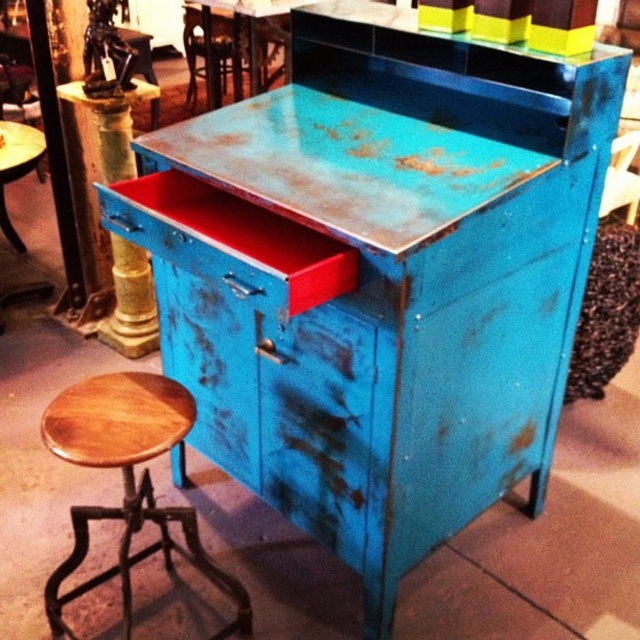
You are standing in front of the vintage blue cabinet with a red drawer. There are two points marked on the cabinet. One is at coordinate point (148, 454) and the other is at point (621, 204). Which point is closer to you?

Point (148, 454) is closer to the camera than point (621, 204).

You are organizing a small event and need to arrange seating. You have a wooden chair at center and a metallic blue chair at center. If you want to place both chairs so that the metallic blue chair is visible from the front entrance, where should you position them relative to each other?

To ensure the metallic blue chair at center is visible from the front entrance, position the wooden chair at center in front of it, allowing the metallic blue chair at center to be seen behind the wooden chair at center.

You are standing in front of the blue cabinet and want to place a small potted plant on the surface. There are two spots available at coordinates point (100, 376) and point (208, 58). Which coordinate is closer to you and suitable for placing the plant?

Point (100, 376) is closer to the viewer than point (208, 58), so it is the suitable coordinate for placing the plant.